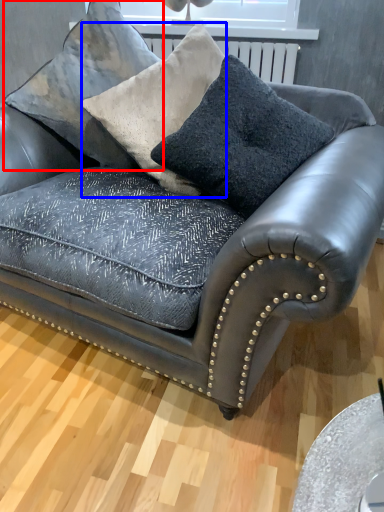
Question: Which point is further to the camera, pillow (highlighted by a red box) or throw pillow (highlighted by a blue box)?

Choices:
 (A) pillow
 (B) throw pillow

Answer: (A)